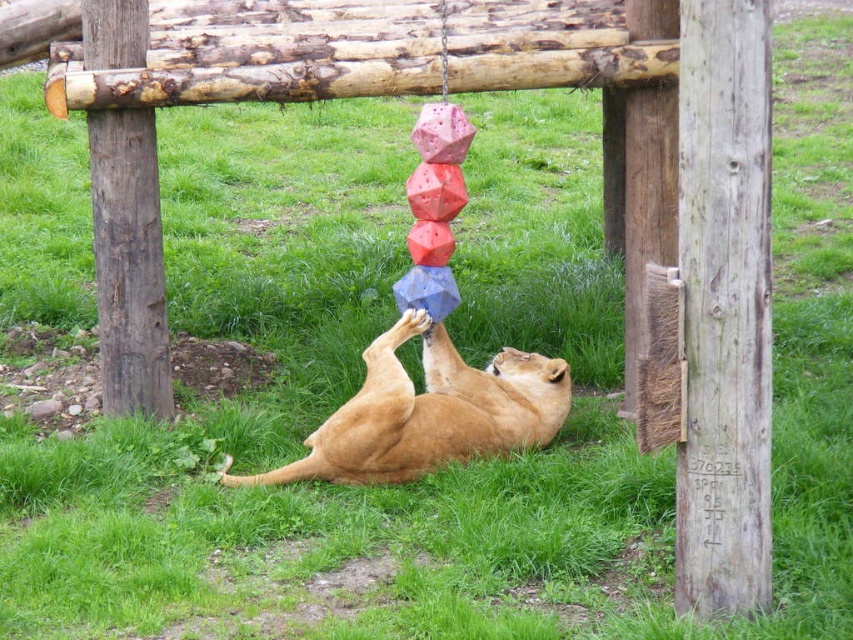
Can you confirm if weathered wood pole at right is positioned below brown rough wood pole at left?

Indeed, weathered wood pole at right is positioned under brown rough wood pole at left.

Does weathered wood pole at right have a lesser height compared to brown rough wood pole at left?

In fact, weathered wood pole at right may be taller than brown rough wood pole at left.

Who is more forward, (712, 292) or (123, 1)?

Point (712, 292) is more forward.

Find the location of a particular element. The width and height of the screenshot is (853, 640). weathered wood pole at right is located at coordinates (724, 307).

Is weathered wood pole at right in front of golden fur lion at center?

Result: Yes.

Is weathered wood pole at right taller than golden fur lion at center?

Correct, weathered wood pole at right is much taller as golden fur lion at center.

Image resolution: width=853 pixels, height=640 pixels. In order to click on weathered wood pole at right in this screenshot , I will do `click(724, 307)`.

Can you confirm if golden fur lion at center is taller than brown rough wood pole at left?

In fact, golden fur lion at center may be shorter than brown rough wood pole at left.

How much distance is there between golden fur lion at center and brown rough wood pole at left?

golden fur lion at center and brown rough wood pole at left are 4.11 feet apart.

This screenshot has width=853, height=640. I want to click on golden fur lion at center, so click(428, 412).